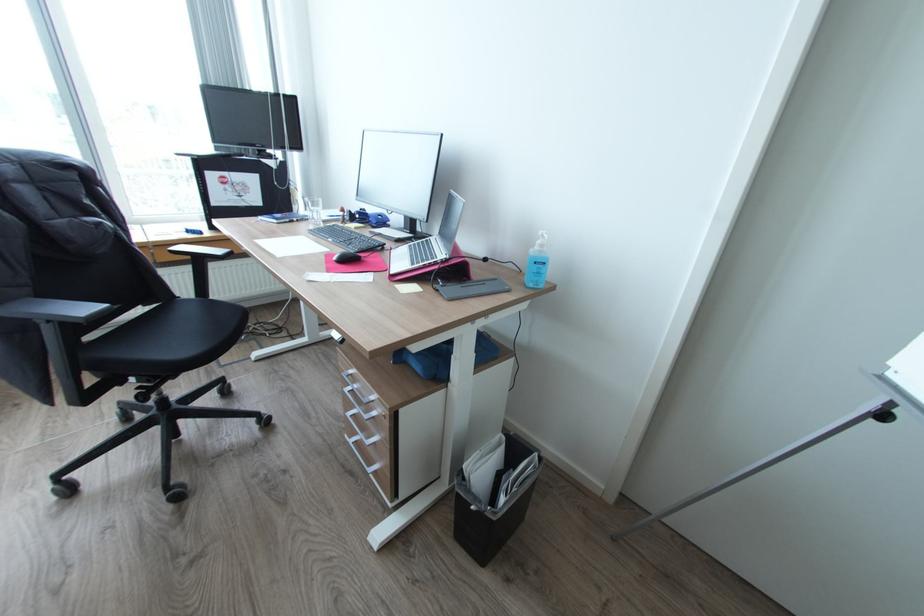
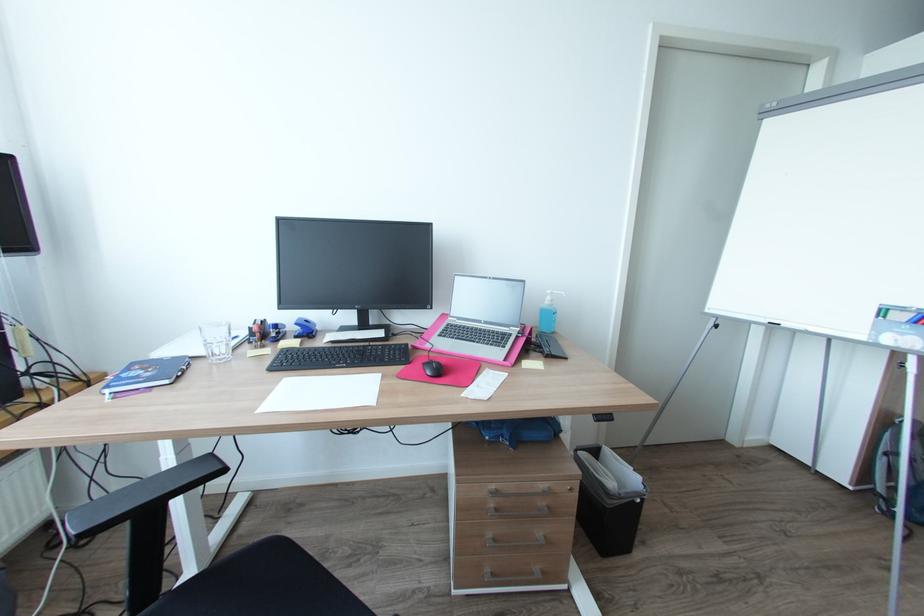
The point at (281, 221) is marked in the first image. Where is the corresponding point in the second image?

(171, 381)